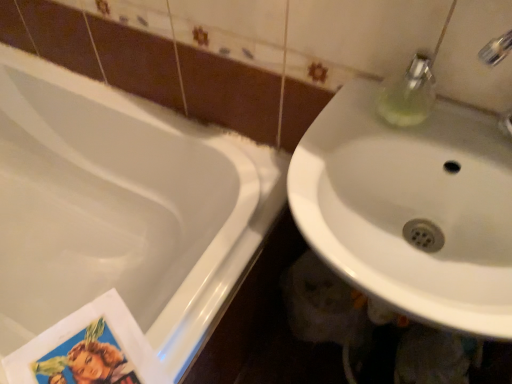
At what (x,y) coordinates should I click in order to perform the action: click on white glossy sink at right. Please return your answer as a coordinate pair (x, y). The width and height of the screenshot is (512, 384). Looking at the image, I should click on (411, 208).

Image resolution: width=512 pixels, height=384 pixels. Describe the element at coordinates (411, 208) in the screenshot. I see `white glossy sink at right` at that location.

Measure the distance between white glossy sink at right and camera.

They are 18.34 inches apart.

What do you see at coordinates (122, 208) in the screenshot?
I see `white glossy bathtub at lower left` at bounding box center [122, 208].

Locate an element on the screen. This screenshot has height=384, width=512. white glossy bathtub at lower left is located at coordinates (122, 208).

Find the location of `white glossy sink at right`. white glossy sink at right is located at coordinates (411, 208).

Is white glossy sink at right at the left side of white glossy bathtub at lower left?

No, white glossy sink at right is not to the left of white glossy bathtub at lower left.

Is white glossy sink at right positioned behind white glossy bathtub at lower left?

No, white glossy sink at right is closer to the viewer.

Does point (401, 250) appear closer or farther from the camera than point (254, 145)?

Point (401, 250).

From the image's perspective, between white glossy sink at right and white glossy bathtub at lower left, which one is located above?

white glossy sink at right appears higher in the image.

From a real-world perspective, is white glossy sink at right located higher than white glossy bathtub at lower left?

Yes.

Considering the sizes of objects white glossy sink at right and white glossy bathtub at lower left in the image provided, who is thinner, white glossy sink at right or white glossy bathtub at lower left?

With smaller width is white glossy sink at right.

Does white glossy sink at right have a lesser height compared to white glossy bathtub at lower left?

Correct, white glossy sink at right is not as tall as white glossy bathtub at lower left.

Between white glossy sink at right and white glossy bathtub at lower left, which one has smaller size?

white glossy sink at right is smaller.

Looking at this image, is white glossy sink at right completely or partially outside of white glossy bathtub at lower left?

white glossy sink at right is positioned outside white glossy bathtub at lower left.

Is white glossy sink at right beside white glossy bathtub at lower left?

white glossy sink at right is not next to white glossy bathtub at lower left, and they're not touching.

Is white glossy sink at right oriented away from white glossy bathtub at lower left?

No.

Identify the location of bathtub on the left side of white glossy sink at right. The image size is (512, 384). (122, 208).

Which object is positioned more to the right, white glossy bathtub at lower left or white glossy sink at right?

white glossy sink at right is more to the right.

Between white glossy bathtub at lower left and white glossy sink at right, which one is positioned in front?

white glossy sink at right is more forward.

Between point (192, 248) and point (321, 245), which one is positioned behind?

The point (192, 248) is farther.

In the scene shown: From the image's perspective, who appears lower, white glossy bathtub at lower left or white glossy sink at right?

white glossy bathtub at lower left.

Based on the photo, from a real-world perspective, which object stands above the other?

In real-world perspective, white glossy sink at right is above.

Considering the sizes of objects white glossy bathtub at lower left and white glossy sink at right in the image provided, who is thinner, white glossy bathtub at lower left or white glossy sink at right?

With smaller width is white glossy sink at right.

Considering the relative sizes of white glossy bathtub at lower left and white glossy sink at right in the image provided, is white glossy bathtub at lower left shorter than white glossy sink at right?

No.

Consider the image. Considering the relative sizes of white glossy bathtub at lower left and white glossy sink at right in the image provided, is white glossy bathtub at lower left bigger than white glossy sink at right?

Indeed, white glossy bathtub at lower left has a larger size compared to white glossy sink at right.

Is white glossy bathtub at lower left positioned beyond the bounds of white glossy sink at right?

Yes, white glossy bathtub at lower left is not within white glossy sink at right.

Are white glossy bathtub at lower left and white glossy sink at right beside each other?

There is a gap between white glossy bathtub at lower left and white glossy sink at right.

Is white glossy bathtub at lower left aimed at white glossy sink at right?

No, white glossy bathtub at lower left is not aimed at white glossy sink at right.

How much distance is there between white glossy bathtub at lower left and white glossy sink at right?

white glossy bathtub at lower left and white glossy sink at right are 20.27 inches apart from each other.

Where is `sink in front of the white glossy bathtub at lower left`? sink in front of the white glossy bathtub at lower left is located at coordinates (411, 208).

Locate an element on the screen. bathtub that is behind the white glossy sink at right is located at coordinates (122, 208).

Locate an element on the screen. sink on the right of white glossy bathtub at lower left is located at coordinates click(411, 208).